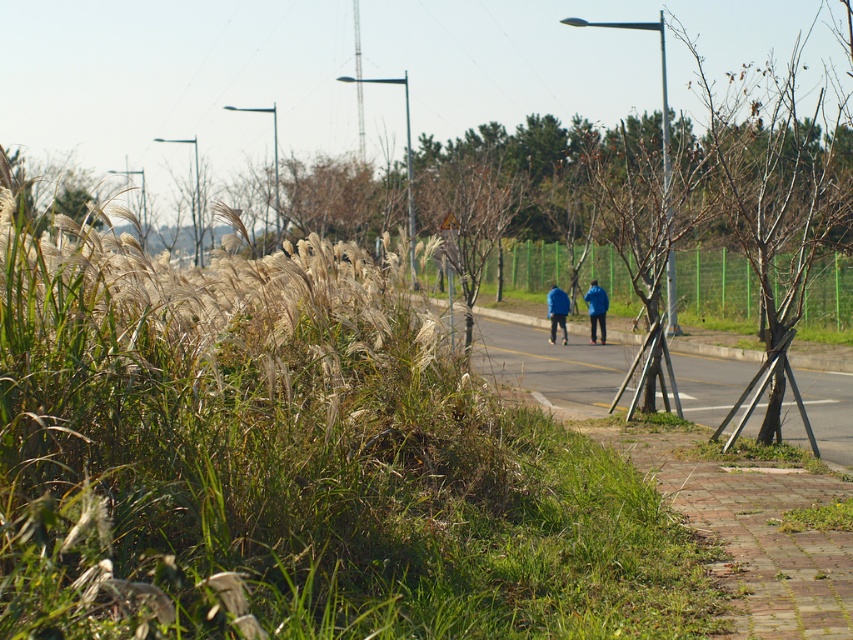
Question: Which point appears closest to the camera in this image?

Choices:
 (A) (605, 333)
 (B) (561, 307)
 (C) (550, 337)
 (D) (627, 348)

Answer: (D)

Question: Is blue matte jacket at center above blue fabric jacket at center?

Choices:
 (A) yes
 (B) no

Answer: (A)

Question: Does blue fabric jackets at center appear under blue fabric jacket at center?

Choices:
 (A) yes
 (B) no

Answer: (B)

Question: Which point is farther to the camera?

Choices:
 (A) (601, 307)
 (B) (561, 337)
 (C) (607, 300)

Answer: (C)

Question: Which point is closer to the camera?

Choices:
 (A) blue matte jacket at center
 (B) blue fabric jackets at center
 (C) blue fabric jacket at center

Answer: (C)

Question: Does green grass at center appear under blue fabric jacket at center?

Choices:
 (A) yes
 (B) no

Answer: (A)